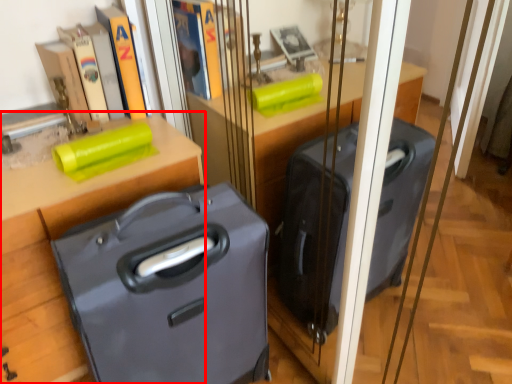
Question: From the image's perspective, what is the correct spatial positioning of furniture (annotated by the red box) in reference to suitcase?

Choices:
 (A) above
 (B) below

Answer: (A)